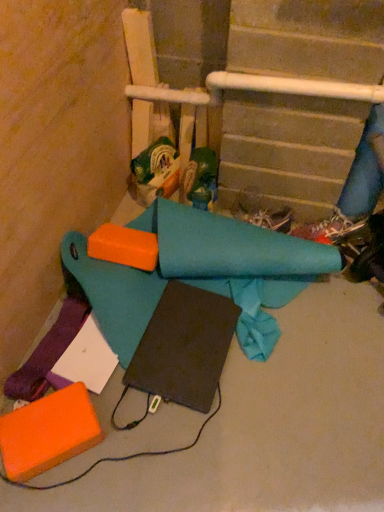
Image resolution: width=384 pixels, height=512 pixels. What are the coordinates of `vacant space in front of black matte notebook at center` in the screenshot? It's located at (201, 446).